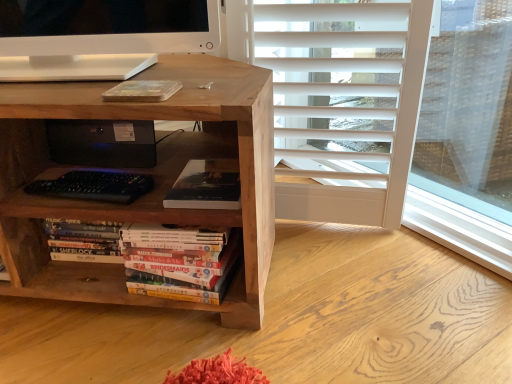
Question: Would you say black plastic speaker at center is inside or outside natural wood desk at center?

Choices:
 (A) outside
 (B) inside

Answer: (B)

Question: Considering the positions of black plastic speaker at center and natural wood desk at center in the image, is black plastic speaker at center wider or thinner than natural wood desk at center?

Choices:
 (A) thin
 (B) wide

Answer: (A)

Question: Which of these objects is positioned closest to the matte black book at center, positioned as the second book in bottom-to-top order?

Choices:
 (A) hardcover books at center, which is the 2th book from top to bottom
 (B) black plastic speaker at center
 (C) natural wood desk at center

Answer: (A)

Question: Which of these objects is positioned farthest from the matte black book at center, positioned as the first book in top-to-bottom order?

Choices:
 (A) black plastic speaker at center
 (B) hardcover books at center, which is the 2th book from top to bottom
 (C) natural wood desk at center

Answer: (A)